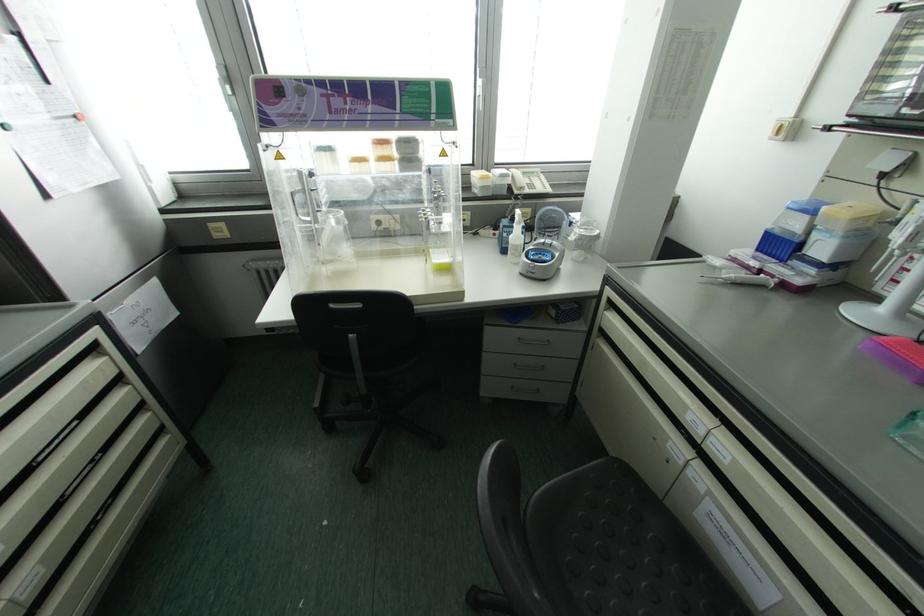
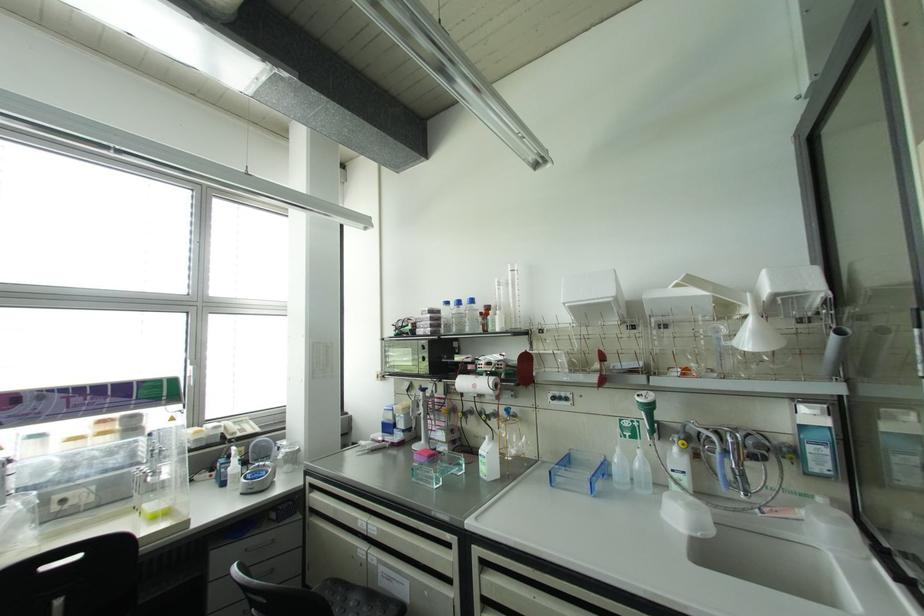
In the second image, find the point that corresponds to the point at 777,245 in the first image.

(387, 427)